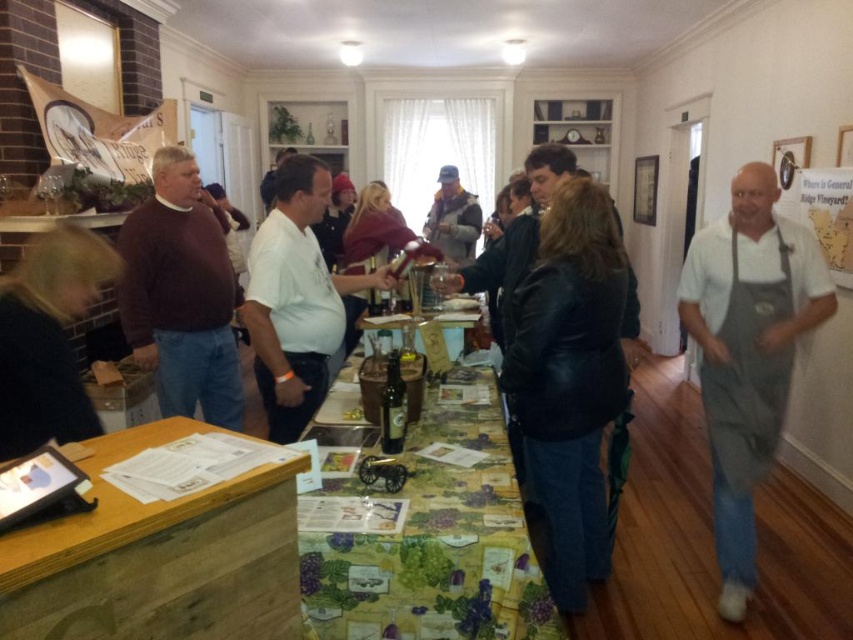
Question: Which object is farther from the camera taking this photo?

Choices:
 (A) translucent glass bottles at center
 (B) gray fabric apron at right
 (C) gray apron at right

Answer: (A)

Question: Which object appears farthest from the camera in this image?

Choices:
 (A) white matte shirt at center
 (B) brown sweater at left
 (C) green glass bottle at center

Answer: (B)

Question: Can you confirm if gray apron at right is thinner than black leather jacket at lower left?

Choices:
 (A) yes
 (B) no

Answer: (B)

Question: Which of these objects is positioned farthest from the gray apron at right?

Choices:
 (A) green glass bottle at center
 (B) white matte shirt at center
 (C) black leather jacket at center
 (D) gray fleece jacket at center

Answer: (D)

Question: Does brown sweater at left appear under white matte shirt at center?

Choices:
 (A) no
 (B) yes

Answer: (A)

Question: Is gray fabric apron at right to the right of translucent glass bottles at center from the viewer's perspective?

Choices:
 (A) no
 (B) yes

Answer: (B)